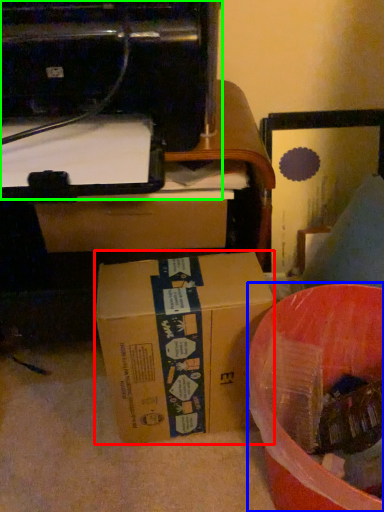
Question: Which object is the farthest from box (highlighted by a red box)? Choose among these: waste (highlighted by a blue box) or printer (highlighted by a green box).

Choices:
 (A) waste
 (B) printer

Answer: (B)